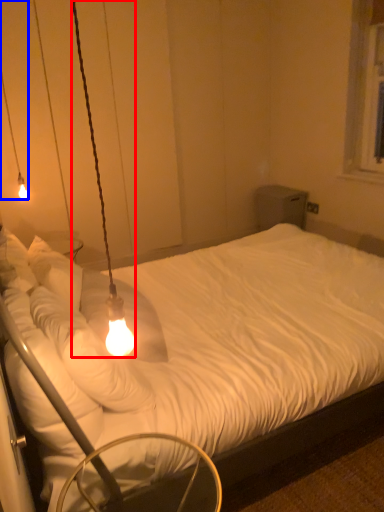
Question: Which object is further to the camera taking this photo, lamp (highlighted by a red box) or lamp (highlighted by a blue box)?

Choices:
 (A) lamp
 (B) lamp

Answer: (B)